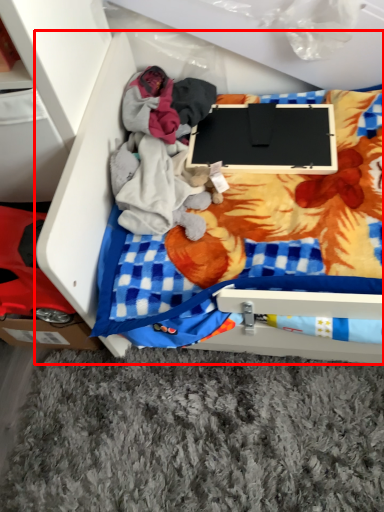
Question: Where is furniture (annotated by the red box) located in relation to laptop in the image?

Choices:
 (A) right
 (B) left

Answer: (B)